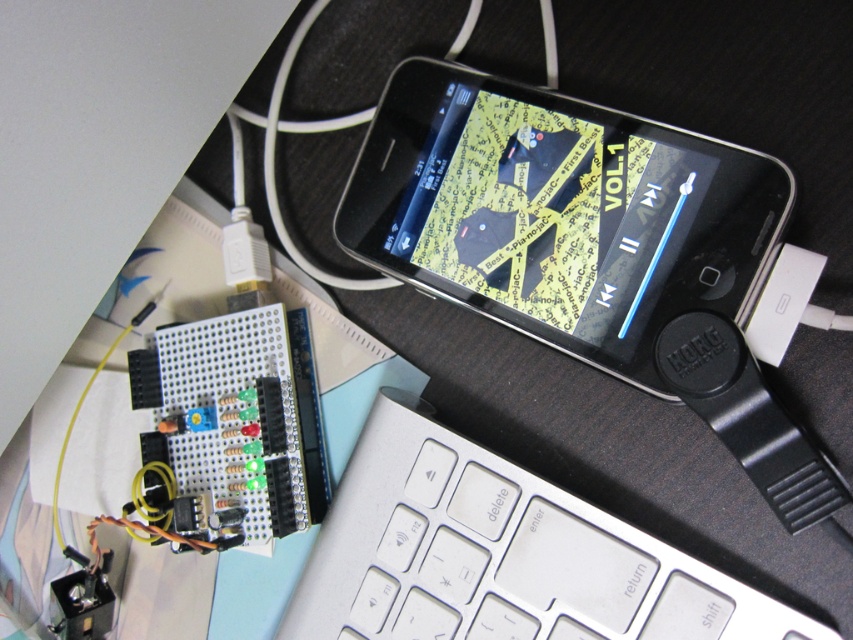
You are standing in front of the workspace and want to reach the point at coordinates point (x=682, y=300). If your hand can extend 28 inches, will you be able to reach it?

The point (x=682, y=300) is 29.06 inches away from the viewer. Since your hand can only extend 28 inches, you will not be able to reach it.